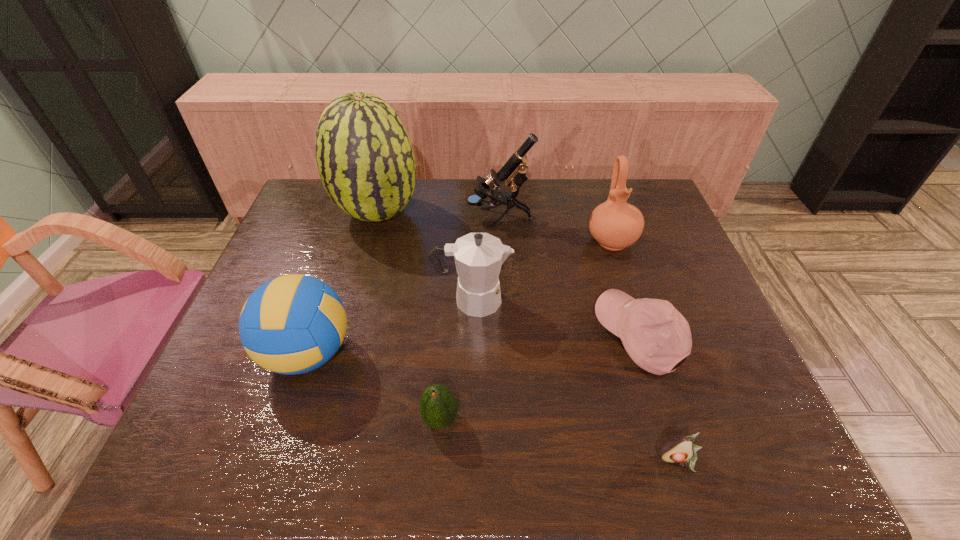
Where is `free area in between the coffeepot and the pottery`? The image size is (960, 540). free area in between the coffeepot and the pottery is located at coordinates (541, 271).

Identify the location of free space between the seventh farthest object and the pottery. (526, 330).

Identify which object is located as the nearest to the coffeepot. Please provide its 2D coordinates. Your answer should be formatted as a tuple, i.e. [(x, y)], where the tuple contains the x and y coordinates of a point satisfying the conditions above.

[(292, 324)]

The width and height of the screenshot is (960, 540). In order to click on the sixth closest object to the right avocado in this screenshot , I will do `click(514, 170)`.